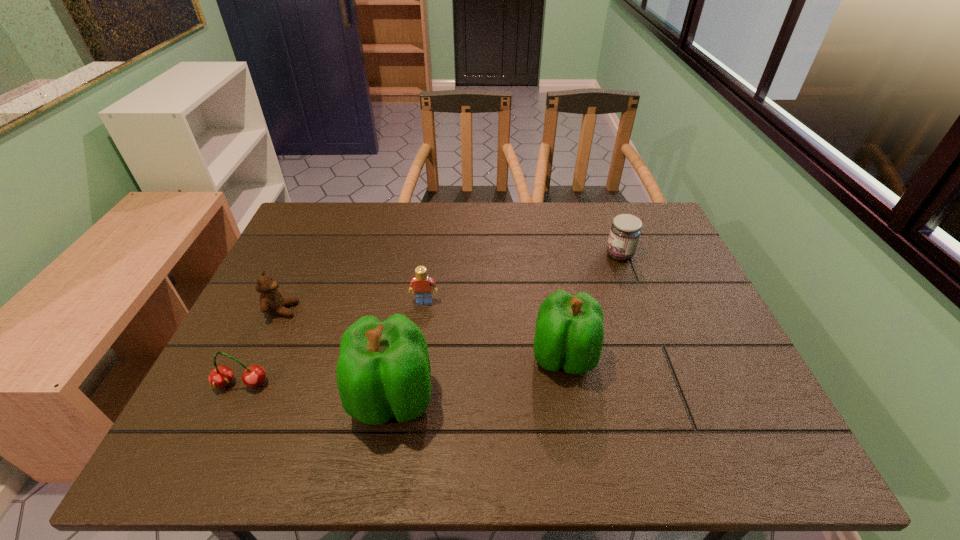
At what (x,y) coordinates should I click in order to perform the action: click on vacant point that satisfies the following two spatial constraints: 1. on the back side of the right bell pepper; 2. at the face of the teddy bear. Please return your answer as a coordinate pair (x, y). The image size is (960, 540). Looking at the image, I should click on (556, 310).

Find the location of a particular element. This screenshot has width=960, height=540. vacant area in the image that satisfies the following two spatial constraints: 1. on the front label of the jam; 2. with stems pointing upwards on the cherry is located at coordinates (667, 384).

At what (x,y) coordinates should I click in order to perform the action: click on free space in the image that satisfies the following two spatial constraints: 1. on the front-facing side of the Lego; 2. on the right side of the fifth object from left to right. Please return your answer as a coordinate pair (x, y). This screenshot has height=540, width=960. Looking at the image, I should click on (418, 357).